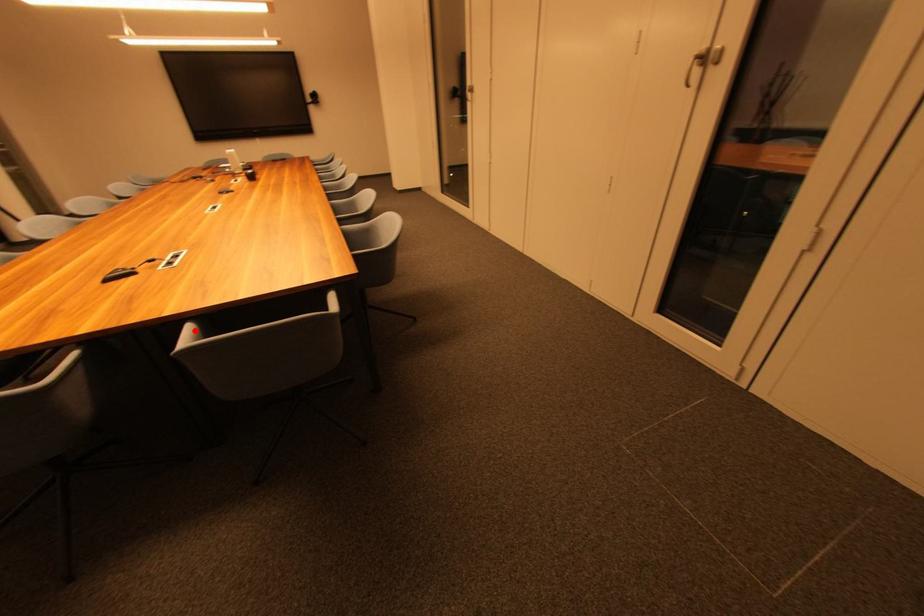
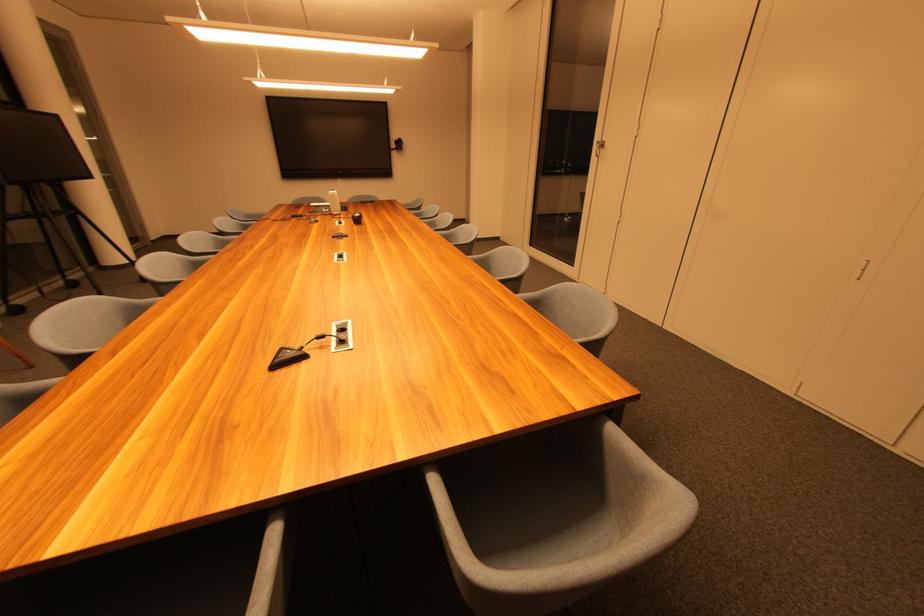
Question: I am providing you with two images of the same scene from different viewpoints. A red point is shown in image1. For the corresponding object point in image2, is it positioned nearer or farther from the camera?

Choices:
 (A) Nearer
 (B) Farther

Answer: (B)